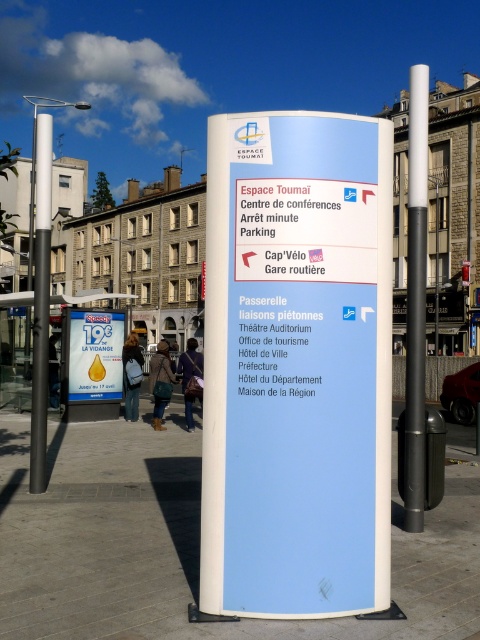
Based on the photo, who is positioned more to the right, blue plastic sign at center or brown leather jacket at center?

blue plastic sign at center

Is blue plastic sign at center closer to the viewer compared to brown leather jacket at center?

That is False.

Locate an element on the screen. blue plastic sign at center is located at coordinates 93,355.

Is brown leather jacket at center positioned in front of denim jacket at center?

Yes, brown leather jacket at center is in front of denim jacket at center.

Is point (157, 342) closer to viewer compared to point (140, 384)?

No, (157, 342) is further to viewer.

Locate an element on the screen. brown leather jacket at center is located at coordinates (159, 381).

In the scene shown: Is the position of white plastic sign at center more distant than that of white glossy pole at upper center?

No.

Does white plastic sign at center have a greater height compared to white glossy pole at upper center?

Incorrect, white plastic sign at center's height is not larger of white glossy pole at upper center's.

Measure the distance between point (276, 179) and camera.

Point (276, 179) and camera are 4.12 meters apart.

What are the coordinates of `white plastic sign at center` in the screenshot? It's located at [x=297, y=365].